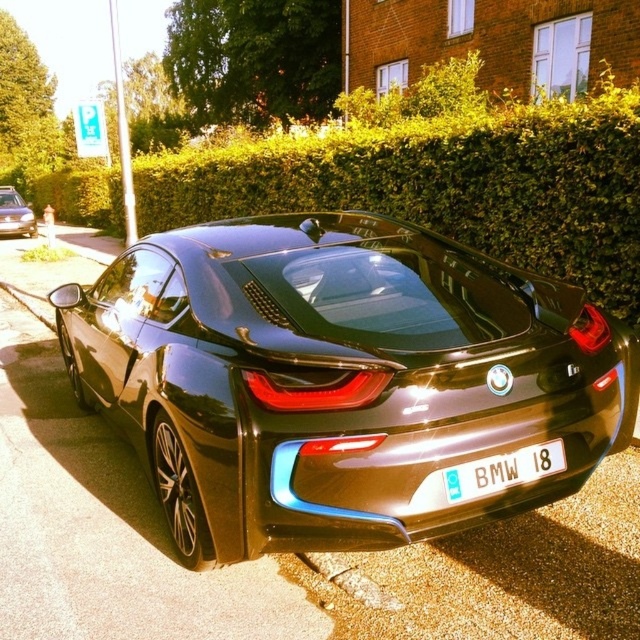
Consider the image. You are a delivery driver and need to deliver a package to the address displayed on the license plate of the matte black car at left. However, the license plate is partially obscured by a tree branch. Can you still read the license plate text from the white plastic license plate at rear?

The white plastic license plate at rear is positioned on the right side of the matte black car at left. Since the license plate is on the right side, it might be visible even if the front is obscured by the branch. However, the question mentions the license plate text is on the rear plate, so the driver should check if the rear plate is visible. If the branch only obscures the front, the rear plate should be readable.